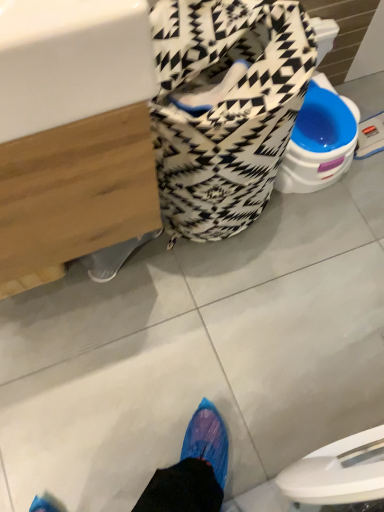
Where is `vacant region to the right of patterned fabric laundry basket at center`? vacant region to the right of patterned fabric laundry basket at center is located at coordinates (329, 232).